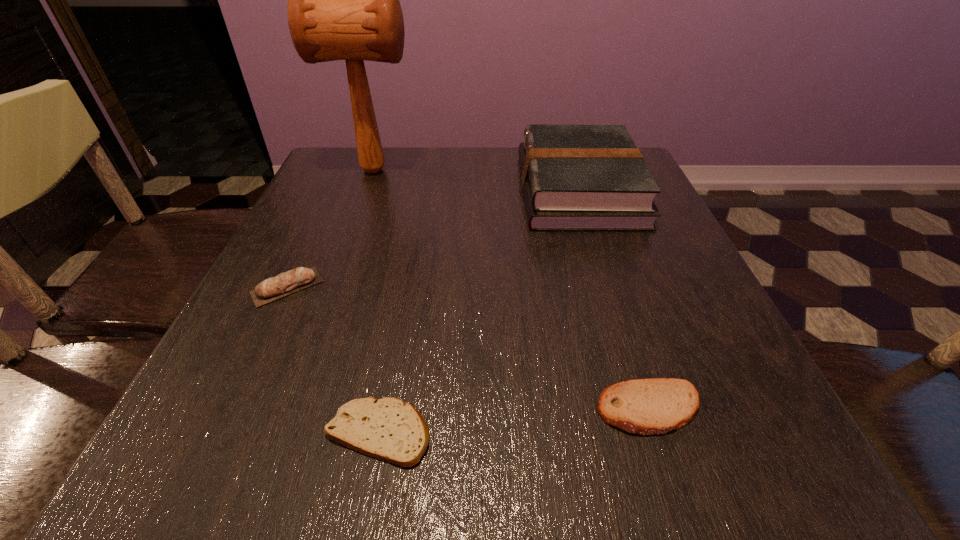
I want to click on free space that satisfies the following two spatial constraints: 1. on the back side of the second shortest object; 2. on the strike surface of the mallet, so click(573, 170).

Identify the location of free spot that satisfies the following two spatial constraints: 1. on the strike surface of the tallest object; 2. on the right side of the rightmost pita bread. The image size is (960, 540). (287, 409).